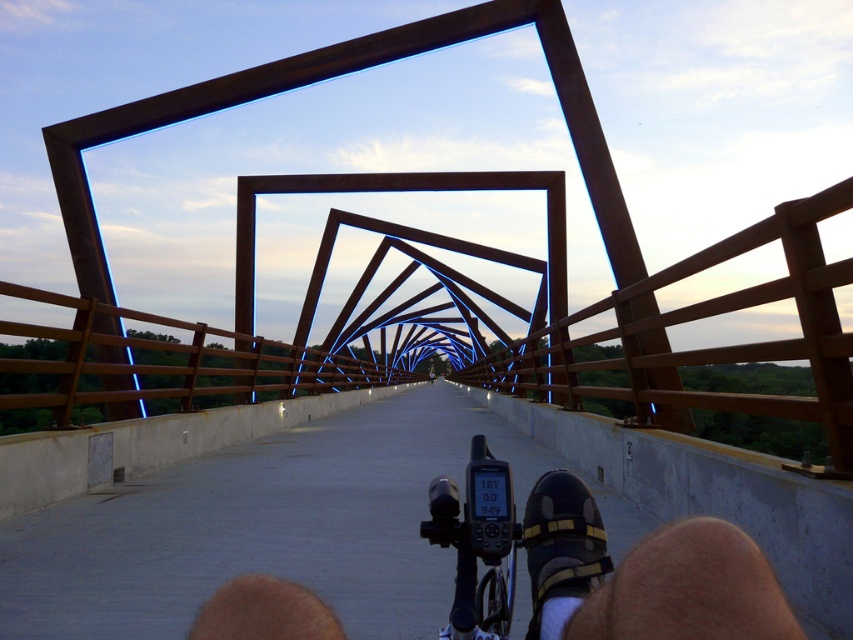
Question: Which point is farther from the camera taking this photo?

Choices:
 (A) (310, 387)
 (B) (505, 554)
 (C) (554, 483)
 (D) (167, 385)

Answer: (A)

Question: Does black matte shoe at center appear on the left side of black plastic gps at center?

Choices:
 (A) yes
 (B) no

Answer: (B)

Question: Which point is closer to the camera taking this photo?

Choices:
 (A) (213, 276)
 (B) (299, 604)
 (C) (552, 483)

Answer: (B)

Question: Can you confirm if black matte shoe at center is bigger than black plastic gps at center?

Choices:
 (A) yes
 (B) no

Answer: (A)

Question: Which of the following is the closest to the observer?

Choices:
 (A) (351, 387)
 (B) (445, 508)

Answer: (B)

Question: Does black matte shoe at center appear over brown wooden rail at center?

Choices:
 (A) yes
 (B) no

Answer: (A)